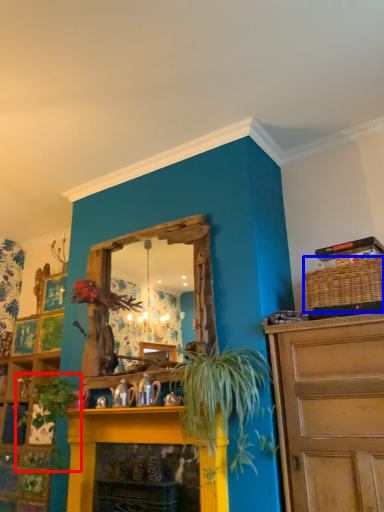
Question: Which point is further to the camera, plant (highlighted by a red box) or basket (highlighted by a blue box)?

Choices:
 (A) plant
 (B) basket

Answer: (A)